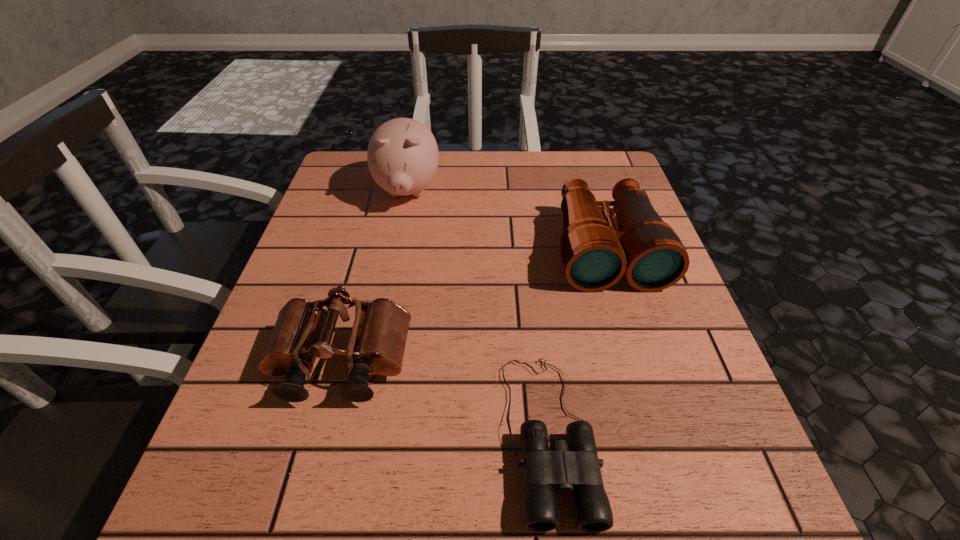
Identify which object is the third closest to the farthest binoculars. Please provide its 2D coordinates. Your answer should be formatted as a tuple, i.e. [(x, y)], where the tuple contains the x and y coordinates of a point satisfying the conditions above.

[(303, 331)]

Identify the location of object that is the closest to the farthest binoculars. point(578,470).

Choose which binoculars is the nearest neighbor to the piggy bank. Please provide its 2D coordinates. Your answer should be formatted as a tuple, i.e. [(x, y)], where the tuple contains the x and y coordinates of a point satisfying the conditions above.

[(595, 255)]

Identify the location of binoculars that is the third closest to the piggy bank. This screenshot has width=960, height=540. (578, 470).